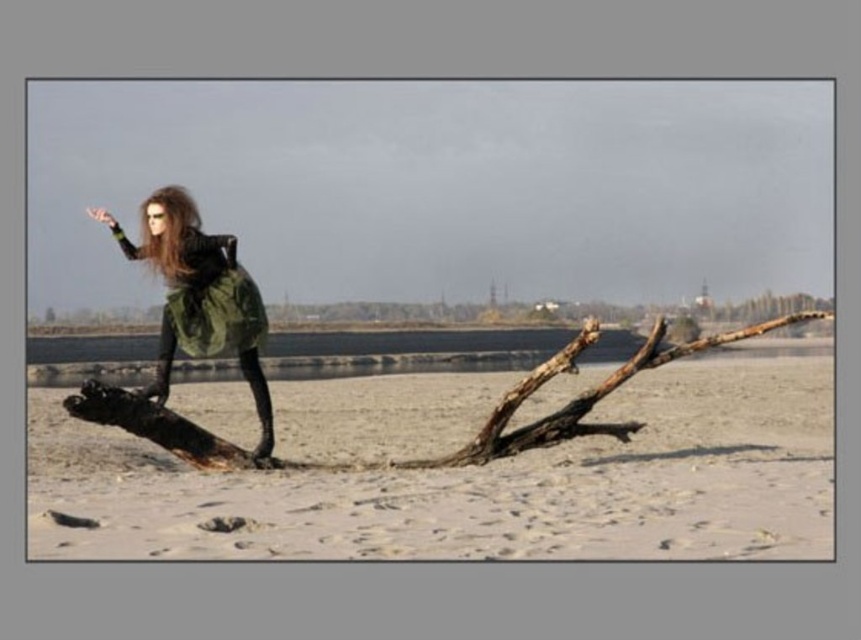
Question: Which point is farther from the camera taking this photo?

Choices:
 (A) (729, 548)
 (B) (257, 336)

Answer: (B)

Question: Where is white sandy beach at center located in relation to green matte dress at center in the image?

Choices:
 (A) left
 (B) right

Answer: (B)

Question: Which is farther from the white sandy beach at center?

Choices:
 (A) green matte dress at center
 (B) shiny brown hair at upper left
 (C) green matte dress at left

Answer: (B)

Question: Can you confirm if green matte dress at center is thinner than shiny brown hair at upper left?

Choices:
 (A) yes
 (B) no

Answer: (B)

Question: Considering the real-world distances, which object is closest to the green matte dress at center?

Choices:
 (A) green matte dress at left
 (B) shiny brown hair at upper left
 (C) white sandy beach at center

Answer: (A)

Question: Considering the relative positions of green matte dress at center and shiny brown hair at upper left in the image provided, where is green matte dress at center located with respect to shiny brown hair at upper left?

Choices:
 (A) above
 (B) below

Answer: (A)